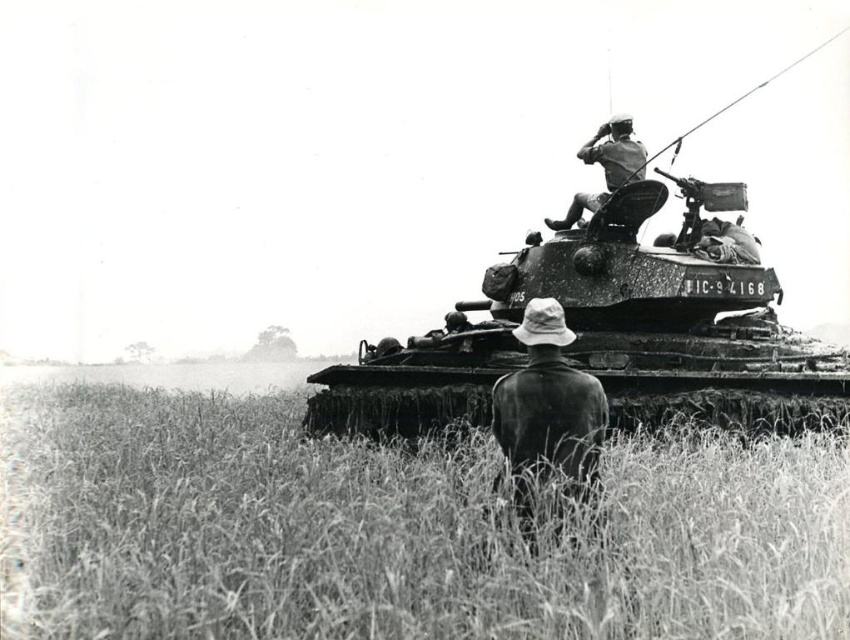
Question: Is grassy field at center positioned at the back of rusty metal tank at center?

Choices:
 (A) no
 (B) yes

Answer: (A)

Question: Which point is farther from the camera taking this photo?

Choices:
 (A) (576, 493)
 (B) (389, 557)
 (C) (746, 244)
 (D) (619, 152)

Answer: (C)

Question: Which object is the farthest from the rusty metal tank at center?

Choices:
 (A) camouflage fabric helmet at upper center
 (B) camouflage fabric soldier at center
 (C) grassy field at center

Answer: (C)

Question: In this image, where is camouflage fabric helmet at upper center located relative to camouflage fabric soldier at center?

Choices:
 (A) left
 (B) right

Answer: (A)

Question: Is grassy field at center behind camouflage fabric helmet at upper center?

Choices:
 (A) no
 (B) yes

Answer: (A)

Question: Which point is closer to the camera?

Choices:
 (A) grassy field at center
 (B) camouflage fabric helmet at upper center

Answer: (A)